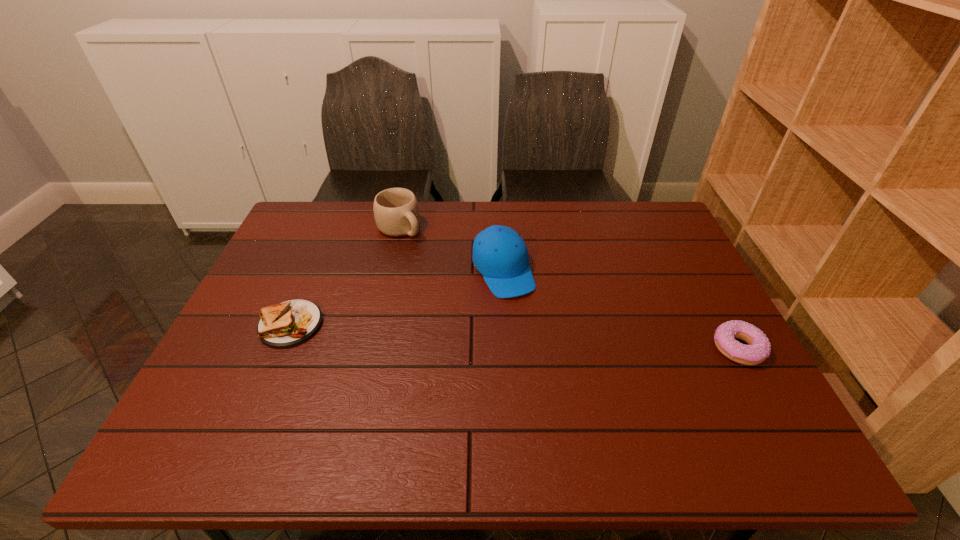
The image size is (960, 540). Identify the location of vacant region between the sandwich and the rightmost object. (515, 336).

The width and height of the screenshot is (960, 540). I want to click on free space between the third nearest object and the doughnut, so click(620, 309).

Where is `free point between the leftmost object and the third object from right to left`? This screenshot has height=540, width=960. free point between the leftmost object and the third object from right to left is located at coordinates (346, 276).

Find the location of a particular element. the closest object to the rightmost object is located at coordinates (500, 254).

Choose which object is the nearest neighbor to the third object from left to right. Please provide its 2D coordinates. Your answer should be formatted as a tuple, i.e. [(x, y)], where the tuple contains the x and y coordinates of a point satisfying the conditions above.

[(396, 212)]